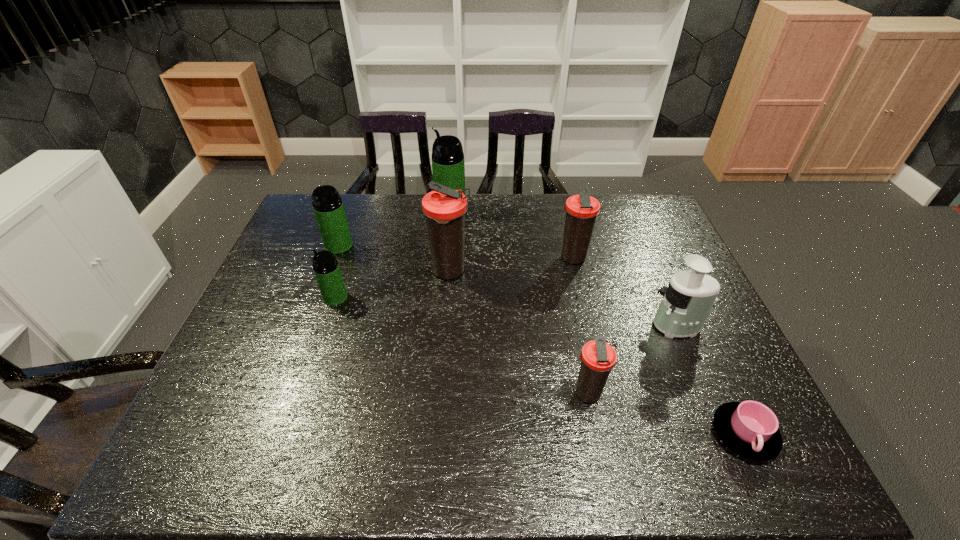
You are a GUI agent. You are given a task and a screenshot of the screen. Output one action in this format:
    pyautogui.click(x=<x>, y=<y>)
    Task: Click on the biggest brown thermos bottle
    
    Given the screenshot: What is the action you would take?
    pyautogui.click(x=444, y=208)

Identify the location of the farthest object. (448, 168).

The width and height of the screenshot is (960, 540). Find the location of `the biggest green thermos bottle`. the biggest green thermos bottle is located at coordinates (448, 168).

Identify the location of the second biggest green thermos bottle. This screenshot has width=960, height=540. (328, 207).

Identify the location of the second biggest brown thermos bottle. The width and height of the screenshot is (960, 540). (581, 210).

This screenshot has width=960, height=540. Identify the location of juicer. (687, 301).

I want to click on the smallest green thermos bottle, so click(326, 268).

Find the location of a particular element. The height and width of the screenshot is (540, 960). the fifth farthest object is located at coordinates (326, 268).

The width and height of the screenshot is (960, 540). I want to click on the nearest brown thermos bottle, so click(597, 357).

Where is `the nearest thermos bottle`? the nearest thermos bottle is located at coordinates (597, 357).